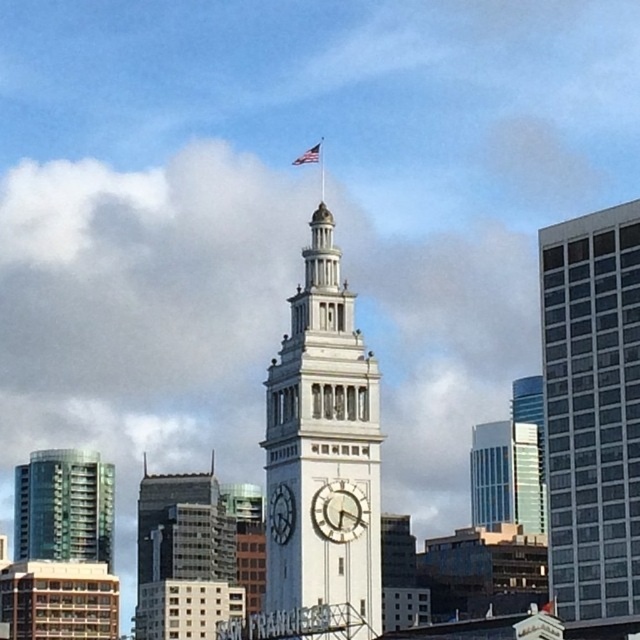
Question: Which point is closer to the camera?

Choices:
 (A) (312, 157)
 (B) (112, 552)
 (C) (340, 336)
 (D) (477, 468)

Answer: (C)

Question: Does white stone clock tower at center have a greater width compared to dark gray stone clock at center?

Choices:
 (A) yes
 (B) no

Answer: (A)

Question: Which object is positioned closest to the gold metallic clock at center?

Choices:
 (A) dark gray stone clock at center
 (B) american flag at upper center
 (C) white stone clock tower at center

Answer: (A)

Question: From the image, what is the correct spatial relationship of glassy blue skyscraper at center in relation to american flag at upper center?

Choices:
 (A) below
 (B) above

Answer: (A)

Question: Which object appears farthest from the camera in this image?

Choices:
 (A) green glass building at left
 (B) gold metallic clock at center
 (C) white glass building at right
 (D) black glass building at center

Answer: (A)

Question: Can you confirm if glassy blue skyscraper at center is positioned to the left of american flag at upper center?

Choices:
 (A) yes
 (B) no

Answer: (B)